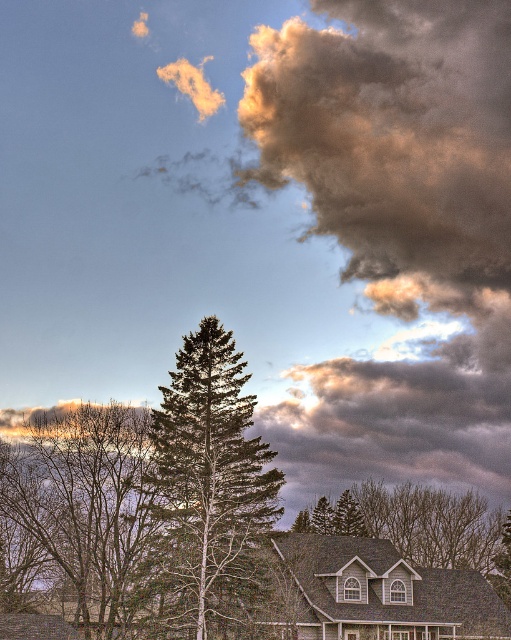
Between brown textured tree at center and green matte evergreen tree at center, which one is positioned higher?

brown textured tree at center is higher up.

Between point (75, 516) and point (316, 520), which one is positioned in front?

Positioned in front is point (75, 516).

Is point (91, 515) more distant than point (313, 515)?

No, it is in front of (313, 515).

The width and height of the screenshot is (511, 640). In order to click on brown textured tree at center in this screenshot , I will do `click(90, 508)`.

Is cloudy textured sky at upper right closer to the viewer compared to green matte evergreen tree at center?

No, it is behind green matte evergreen tree at center.

Can you confirm if cloudy textured sky at upper right is smaller than green matte evergreen tree at center?

No, cloudy textured sky at upper right is not smaller than green matte evergreen tree at center.

Is point (402, 198) positioned in front of point (319, 500)?

No, it is behind (319, 500).

What are the coordinates of `cloudy textured sky at upper right` in the screenshot? It's located at (396, 144).

Is point (249, 540) positioned in front of point (330, 506)?

Yes.

How distant is green needle-like tree at center from green matte evergreen tree at center?

A distance of 36.25 meters exists between green needle-like tree at center and green matte evergreen tree at center.

The width and height of the screenshot is (511, 640). Find the location of `green needle-like tree at center`. green needle-like tree at center is located at coordinates pyautogui.click(x=208, y=468).

Locate an element on the screen. The height and width of the screenshot is (640, 511). green needle-like tree at center is located at coordinates (208, 468).